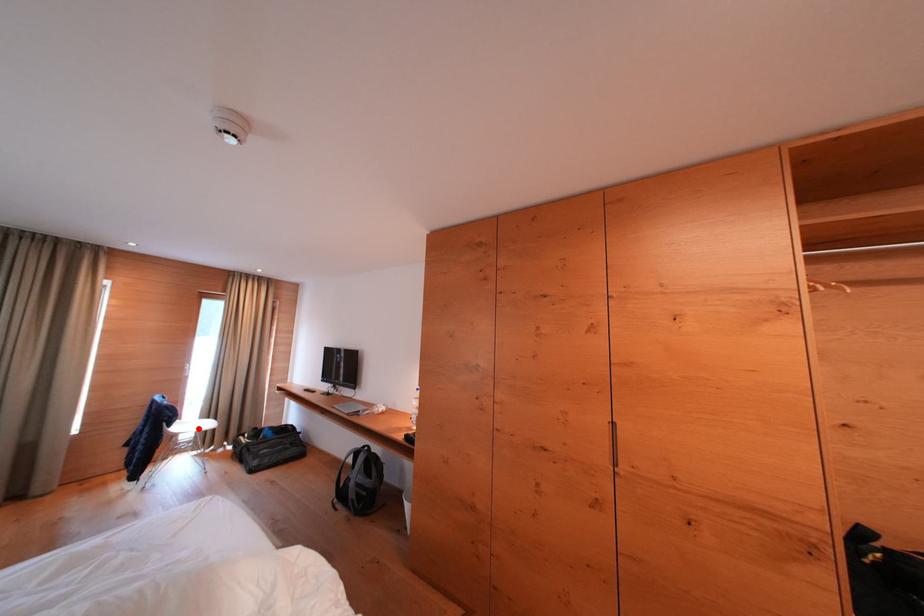
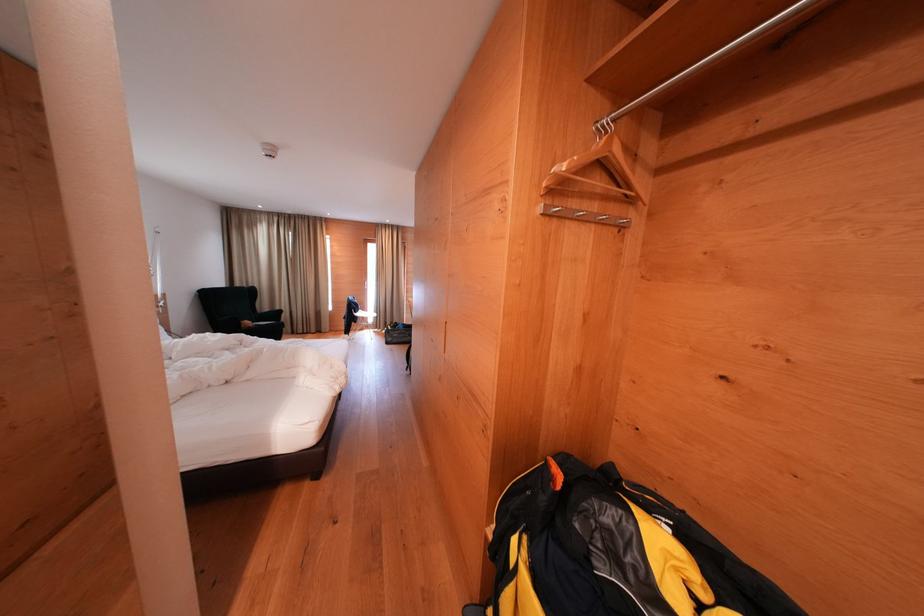
In the second image, find the point that corresponds to the highlighted location in the first image.

(374, 318)